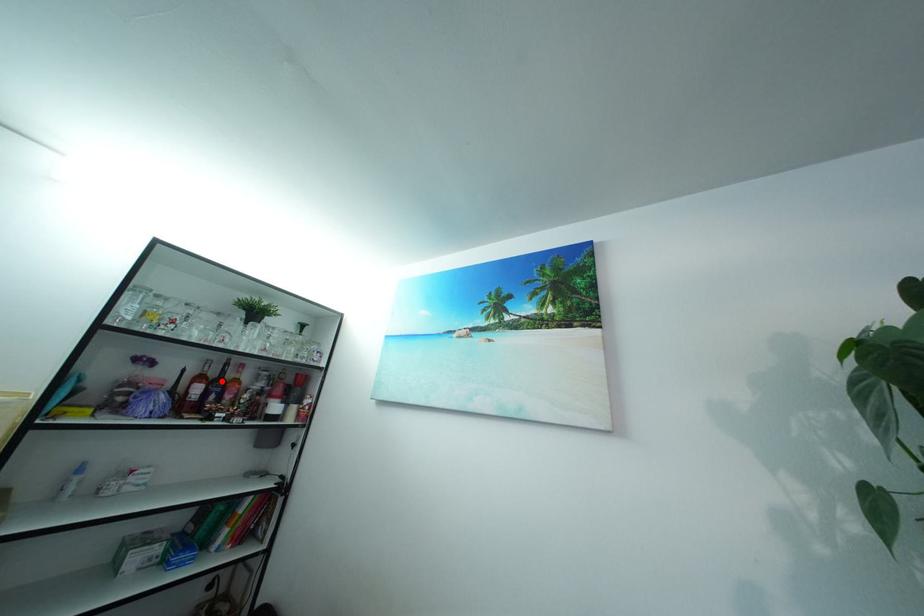
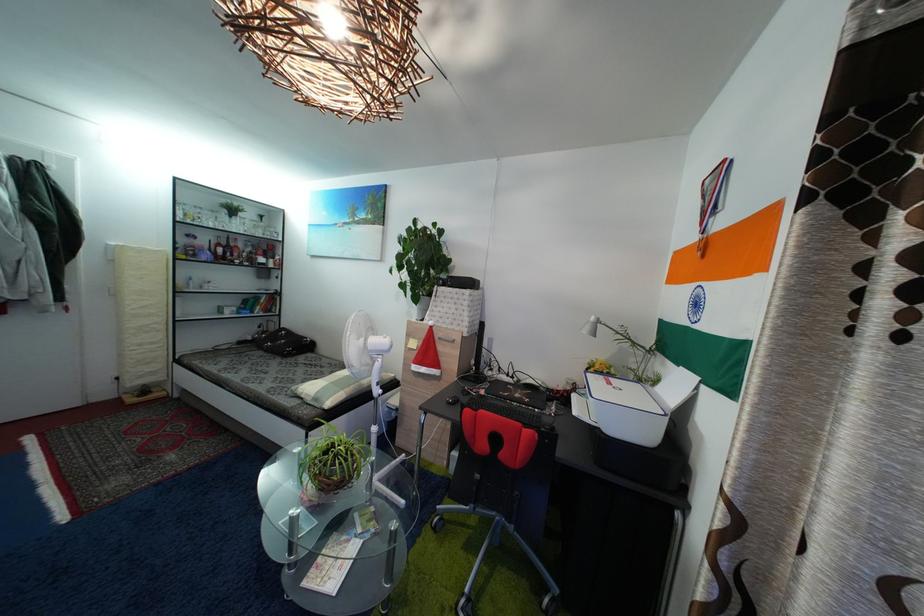
Find the pixel in the second image that matches the highlighted location in the first image.

(233, 251)